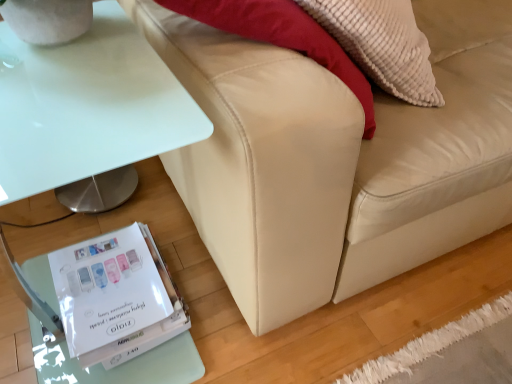
Question: Is white glossy table at lower left smaller than beige leather couch at lower right?

Choices:
 (A) no
 (B) yes

Answer: (B)

Question: Is white glossy table at lower left to the right of beige leather couch at lower right from the viewer's perspective?

Choices:
 (A) yes
 (B) no

Answer: (B)

Question: From a real-world perspective, is white glossy table at lower left below beige leather couch at lower right?

Choices:
 (A) no
 (B) yes

Answer: (B)

Question: Is white glossy table at lower left located outside beige leather couch at lower right?

Choices:
 (A) yes
 (B) no

Answer: (A)

Question: Would you say white glossy table at lower left is a long distance from beige leather couch at lower right?

Choices:
 (A) yes
 (B) no

Answer: (B)

Question: From a real-world perspective, does white glossy table at lower left stand above beige leather couch at lower right?

Choices:
 (A) no
 (B) yes

Answer: (A)

Question: From a real-world perspective, is white glossy paperback book at lower left below white glossy table at lower left?

Choices:
 (A) yes
 (B) no

Answer: (A)

Question: Is white glossy paperback book at lower left further to the viewer compared to white glossy table at lower left?

Choices:
 (A) no
 (B) yes

Answer: (B)

Question: Is white glossy paperback book at lower left oriented away from white glossy table at lower left?

Choices:
 (A) yes
 (B) no

Answer: (A)

Question: Is white glossy paperback book at lower left smaller than white glossy table at lower left?

Choices:
 (A) no
 (B) yes

Answer: (B)

Question: Considering the relative sizes of white glossy paperback book at lower left and white glossy table at lower left in the image provided, is white glossy paperback book at lower left taller than white glossy table at lower left?

Choices:
 (A) yes
 (B) no

Answer: (B)

Question: Are white glossy paperback book at lower left and white glossy table at lower left located far from each other?

Choices:
 (A) yes
 (B) no

Answer: (B)

Question: Is beige leather couch at lower right taller than white glossy table at lower left?

Choices:
 (A) no
 (B) yes

Answer: (B)